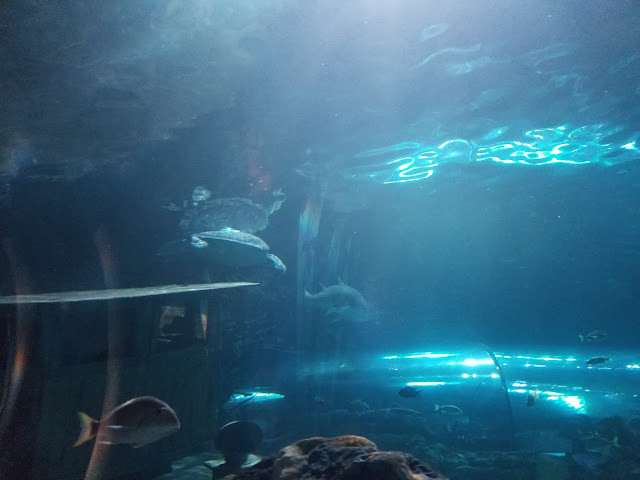
Locate an element on the screen. This screenshot has height=480, width=640. aquarium is located at coordinates (443, 257).